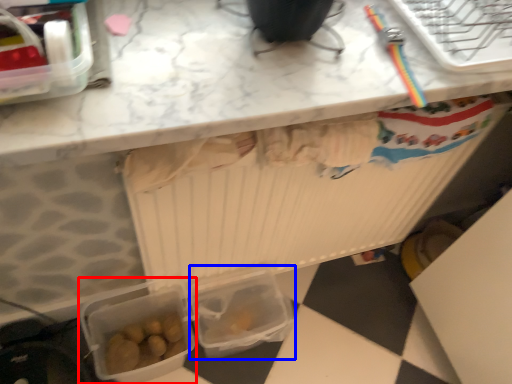
Question: Among these objects, which one is farthest to the camera, lunch box (highlighted by a red box) or lunch box (highlighted by a blue box)?

Choices:
 (A) lunch box
 (B) lunch box

Answer: (B)